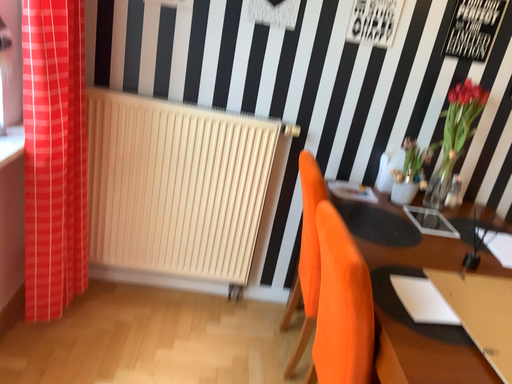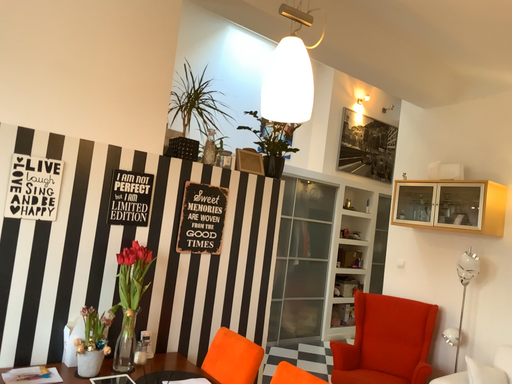
Question: Which way did the camera rotate in the video?

Choices:
 (A) rotated right
 (B) rotated left

Answer: (A)